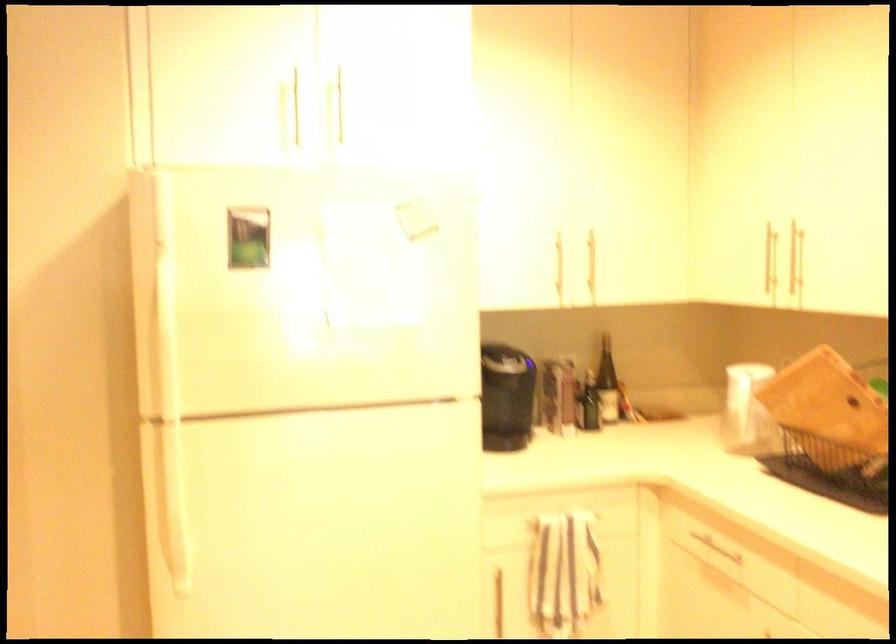
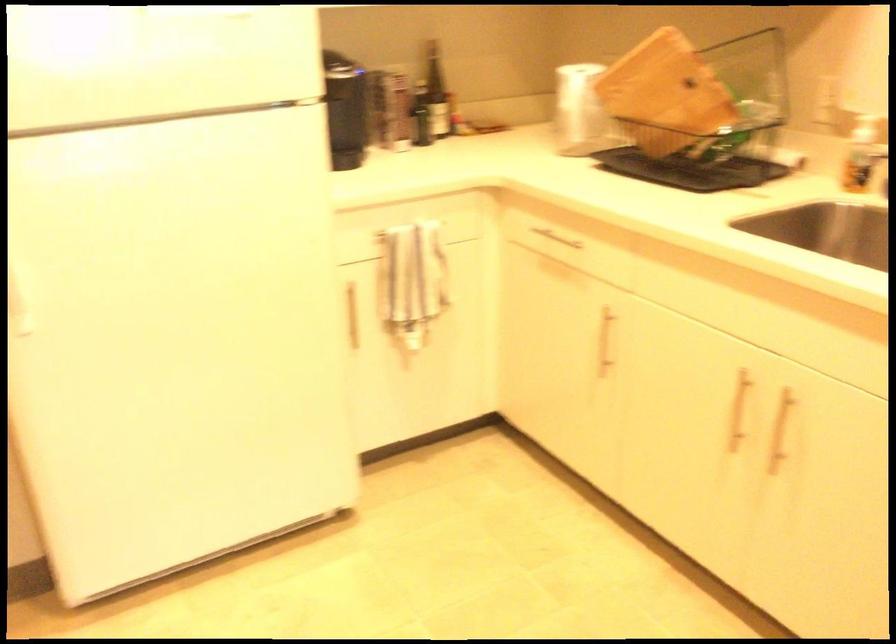
Question: How did the camera likely rotate?

Choices:
 (A) Left
 (B) Right
 (C) Up
 (D) Down

Answer: (D)